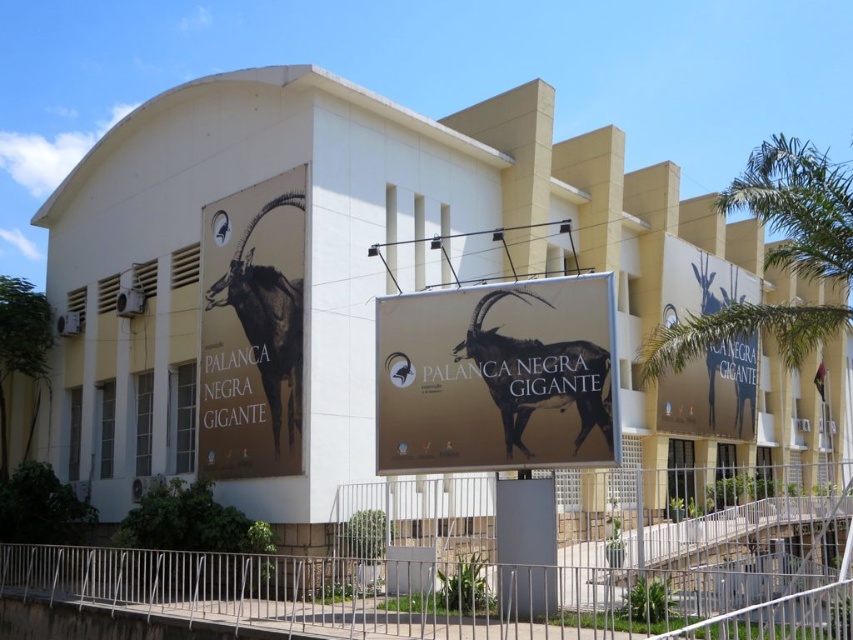
Question: From the image, what is the correct spatial relationship of gold matte sign at center in relation to black glossy ibex at left?

Choices:
 (A) left
 (B) right

Answer: (B)

Question: Does gold matte sign at center appear over matte gold sign at upper right?

Choices:
 (A) no
 (B) yes

Answer: (A)

Question: Which point appears closest to the camera in this image?

Choices:
 (A) (247, 321)
 (B) (445, 449)
 (C) (194, 584)

Answer: (B)

Question: Is gold matte sign at center to the right of matte gold sign at upper right from the viewer's perspective?

Choices:
 (A) yes
 (B) no

Answer: (B)

Question: Based on their relative distances, which object is farther from the gold matte sign at center?

Choices:
 (A) black glossy ibex at left
 (B) metallic silver fence at lower center

Answer: (A)

Question: Among these objects, which one is nearest to the camera?

Choices:
 (A) matte gold sign at upper right
 (B) gold matte sign at center
 (C) black glossy ibex at left
 (D) metallic silver fence at lower center

Answer: (D)